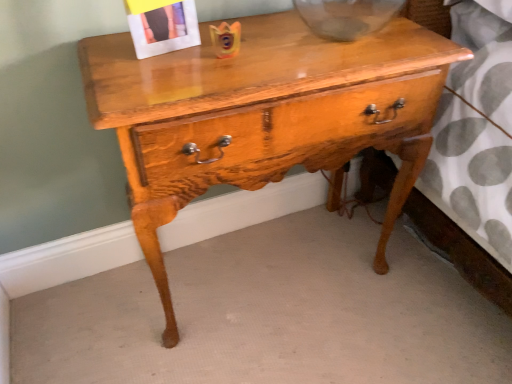
Locate an element on the screen. vacant space situated above glossy wood nightstand at center (from a real-world perspective) is located at coordinates (281, 43).